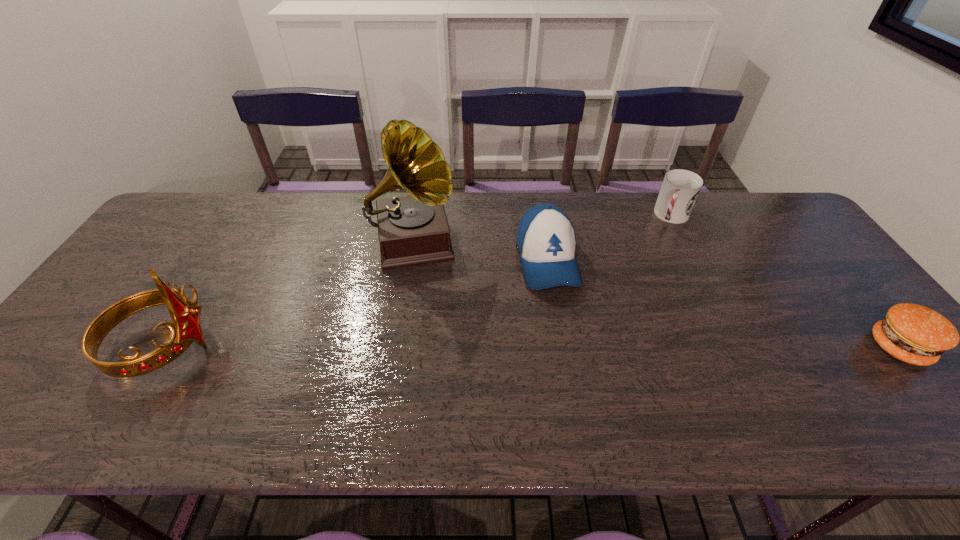
You are a GUI agent. You are given a task and a screenshot of the screen. Output one action in this format:
    pyautogui.click(x=<x>, y=<y>)
    Task: Click on the cup positioned at the far edge
    This screenshot has width=960, height=540.
    Given the screenshot: What is the action you would take?
    pyautogui.click(x=680, y=188)

At what (x,y) coordinates should I click in order to perform the action: click on phonograph record located at the far edge. Please return your answer as a coordinate pair (x, y). The width and height of the screenshot is (960, 540). Looking at the image, I should click on (414, 229).

The image size is (960, 540). I want to click on tiara located in the near edge section of the desktop, so click(x=186, y=328).

In order to click on patty that is at the near edge in this screenshot , I will do `click(912, 333)`.

You are a GUI agent. You are given a task and a screenshot of the screen. Output one action in this format:
    pyautogui.click(x=<x>, y=<y>)
    Task: Click on the object located in the left edge section of the desktop
    
    Given the screenshot: What is the action you would take?
    pyautogui.click(x=186, y=328)

This screenshot has height=540, width=960. In order to click on object at the right edge in this screenshot , I will do `click(912, 333)`.

You are a GUI agent. You are given a task and a screenshot of the screen. Output one action in this format:
    pyautogui.click(x=<x>, y=<y>)
    Task: Click on the object positioned at the near left corner
    This screenshot has width=960, height=540.
    Given the screenshot: What is the action you would take?
    pyautogui.click(x=186, y=328)

Identify the location of object present at the near right corner. (912, 333).

The image size is (960, 540). Identify the location of vacant area at the far edge. (633, 221).

Locate an element on the screen. vacant space at the right edge is located at coordinates click(848, 341).